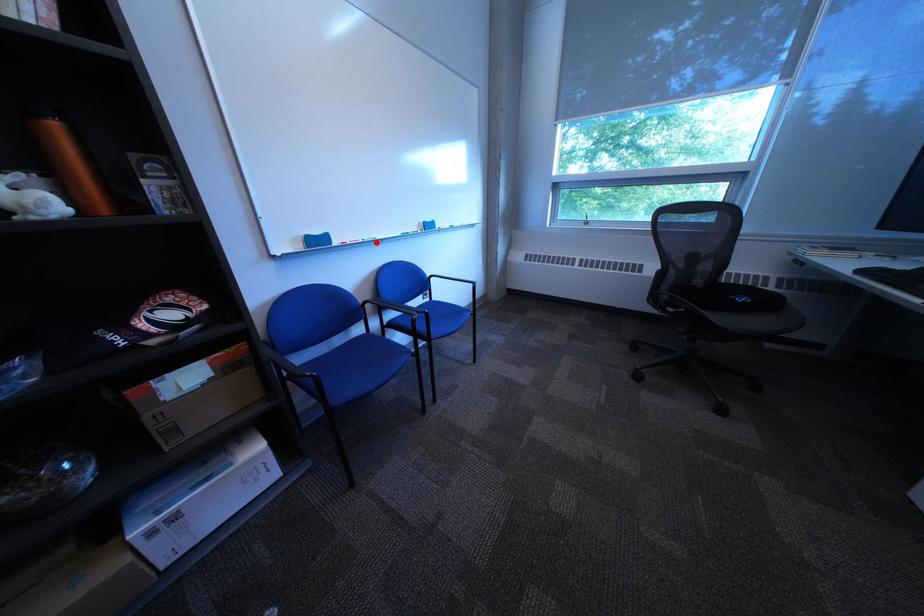
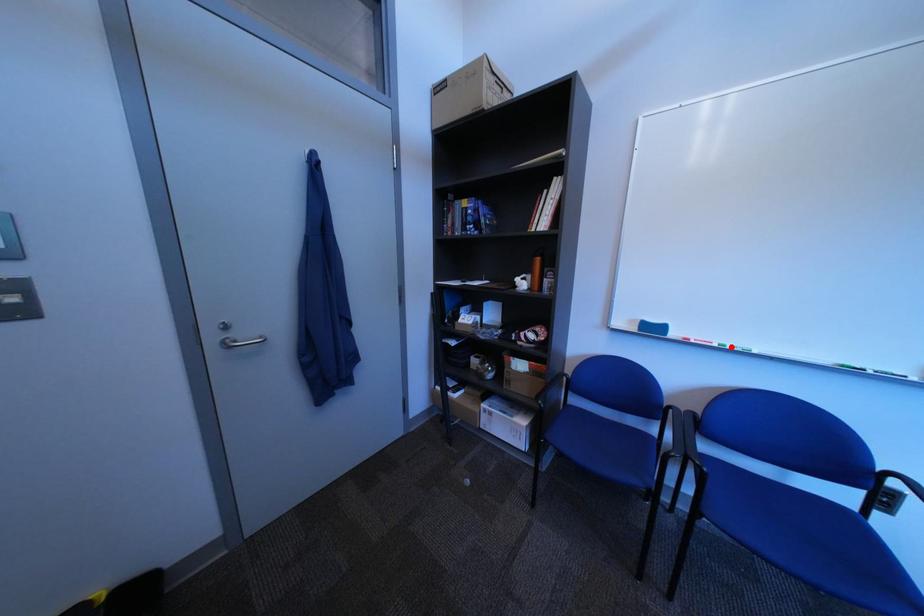
I am providing you with two images of the same scene from different viewpoints. A red point is marked on the first image and another point is marked on the second image. Do the highlighted points in image1 and image2 indicate the same real-world spot?

Yes